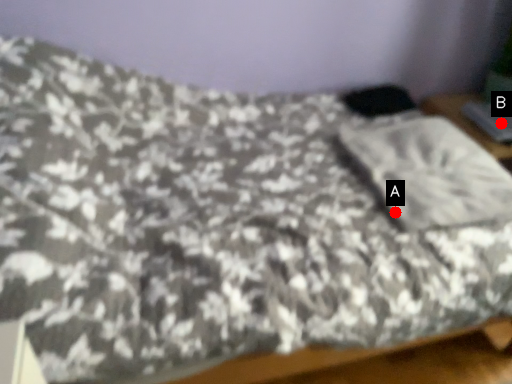
Question: Two points are circled on the image, labeled by A and B beside each circle. Which point appears closest to the camera in this image?

Choices:
 (A) A is closer
 (B) B is closer

Answer: (A)